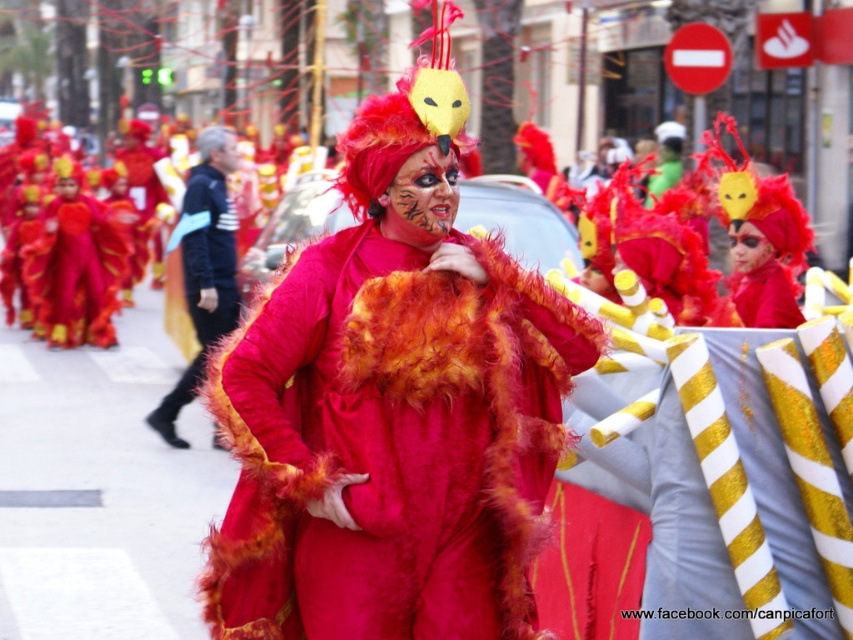
You are a photographer at the parade and want to capture both the fuzzy red costume at center and the velvet red costume at center in a single frame. Which costume should you focus on to ensure both are visible without zooming in or out?

The fuzzy red costume at center is smaller than the velvet red costume at center, so focusing on the velvet red costume at center will allow both to fit in the frame since it takes up more space.